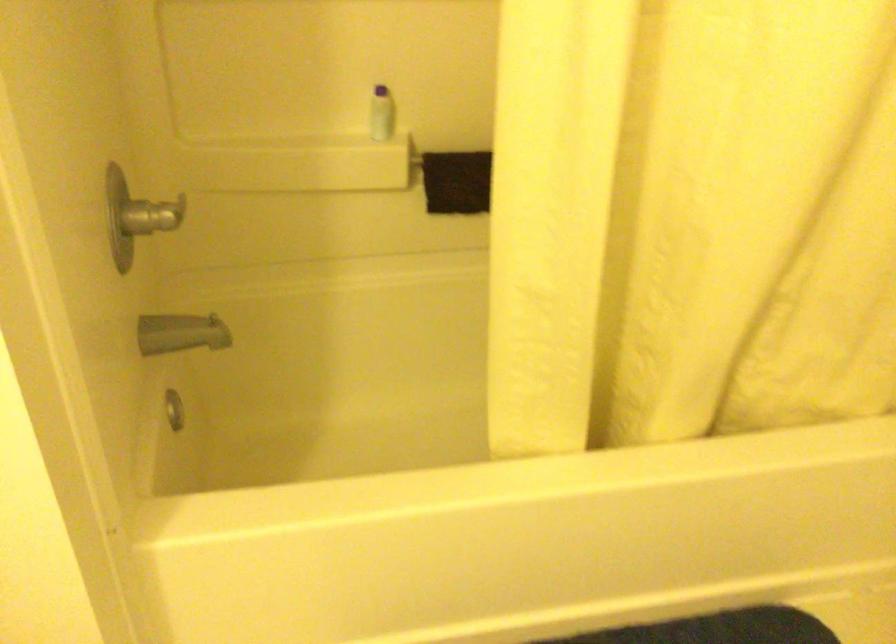
The image size is (896, 644). Identify the location of faucet diverter knob. (174, 410).